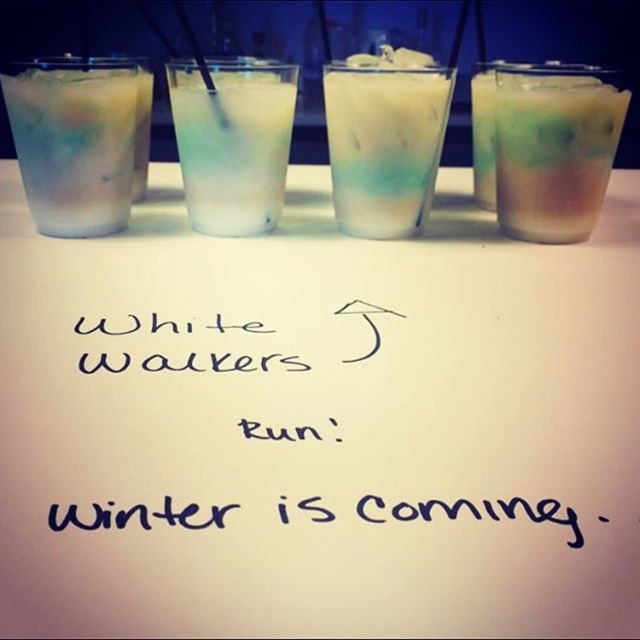
Question: Is translucent glass at right smaller than milky white liquid at center?

Choices:
 (A) yes
 (B) no

Answer: (A)

Question: Estimate the real-world distances between objects in this image. Which object is farther from the translucent glass at right?

Choices:
 (A) white paper at center
 (B) milky white liquid at center
 (C) black handwritten note at center
 (D) translucent glass at left

Answer: (D)

Question: Can you confirm if translucent glass at right is wider than translucent glass at center?

Choices:
 (A) yes
 (B) no

Answer: (B)

Question: Among these points, which one is nearest to the camera?

Choices:
 (A) (429, 301)
 (B) (540, 177)
 (C) (561, 522)

Answer: (C)

Question: Which of the following is the farthest from the observer?

Choices:
 (A) (528, 80)
 (B) (346, 308)

Answer: (A)

Question: Does translucent glass at right appear over translucent glass at center?

Choices:
 (A) no
 (B) yes

Answer: (B)